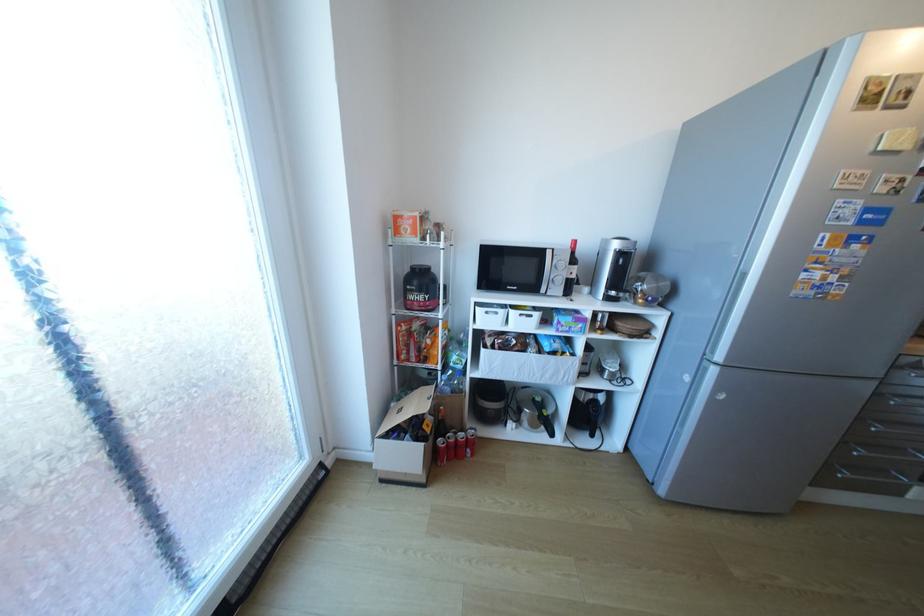
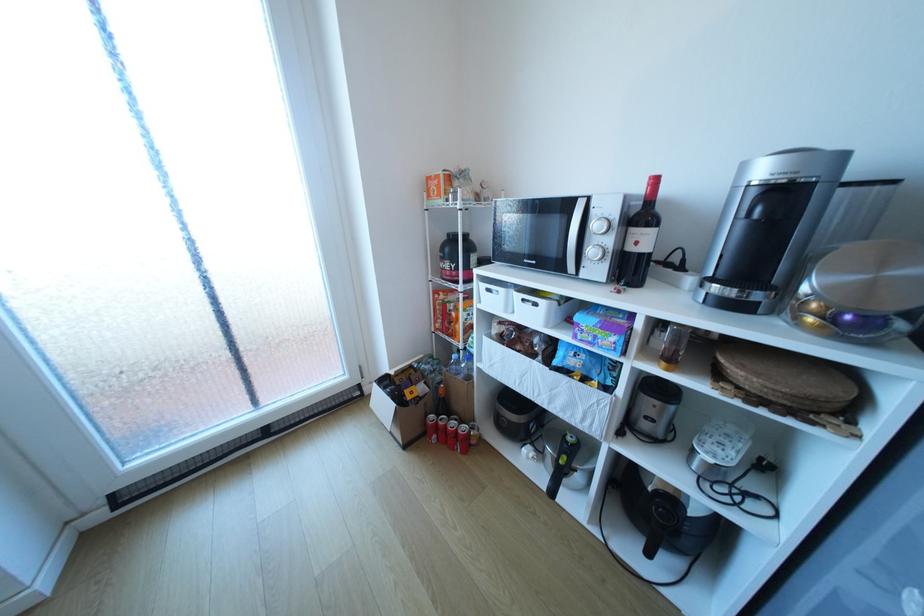
Question: The first image is from the beginning of the video and the second image is from the end. How did the camera likely rotate when shooting the video?

Choices:
 (A) Left
 (B) Right
 (C) Up
 (D) Down

Answer: (A)